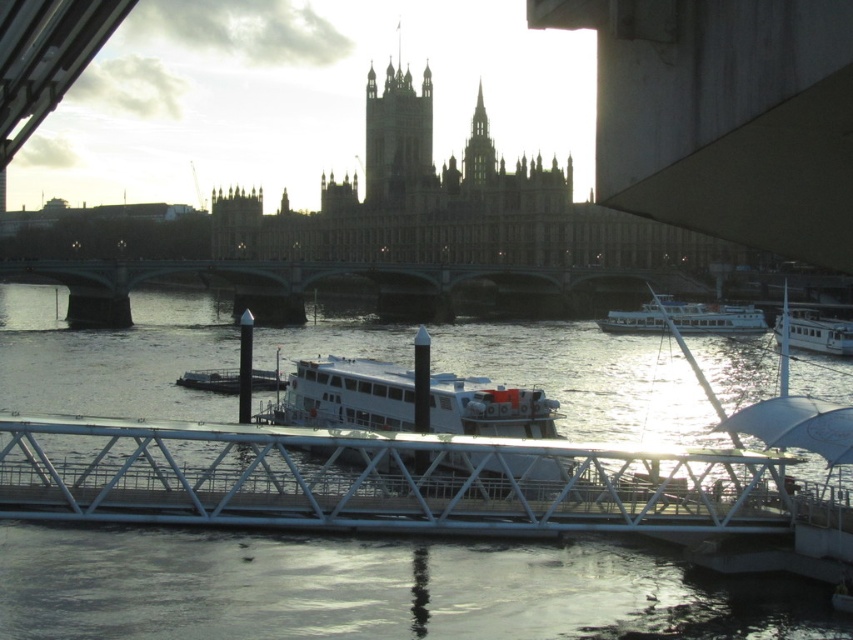
Based on the photo, who is taller, white metallic bridge at center or smooth stone spire at upper center?

With more height is smooth stone spire at upper center.

Consider the image. Which is above, white metallic bridge at center or smooth stone spire at upper center?

Positioned higher is smooth stone spire at upper center.

Is point (457, 456) farther from viewer compared to point (469, 156)?

No.

Find the location of `white metallic bridge at center`. white metallic bridge at center is located at coordinates (375, 480).

Does white matte boat at center have a greater height compared to smooth stone spire at upper center?

No.

Does white matte boat at center have a lesser width compared to smooth stone spire at upper center?

No, white matte boat at center is not thinner than smooth stone spire at upper center.

The width and height of the screenshot is (853, 640). I want to click on white matte boat at center, so click(405, 401).

Is point (606, 564) less distant than point (548, 483)?

Yes, point (606, 564) is closer to viewer.

Between silvery metallic water at center and white matte boat at center, which one appears on the left side from the viewer's perspective?

Positioned to the left is silvery metallic water at center.

What are the coordinates of `silvery metallic water at center` in the screenshot? It's located at (311, 588).

Find the location of a particular element. silvery metallic water at center is located at coordinates tap(311, 588).